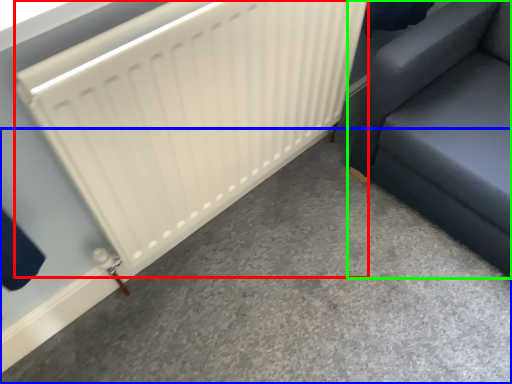
Question: Based on their relative distances, which object is nearer to radiator (highlighted by a red box)? Choose from concrete (highlighted by a blue box) and furniture (highlighted by a green box).

Choices:
 (A) concrete
 (B) furniture

Answer: (B)